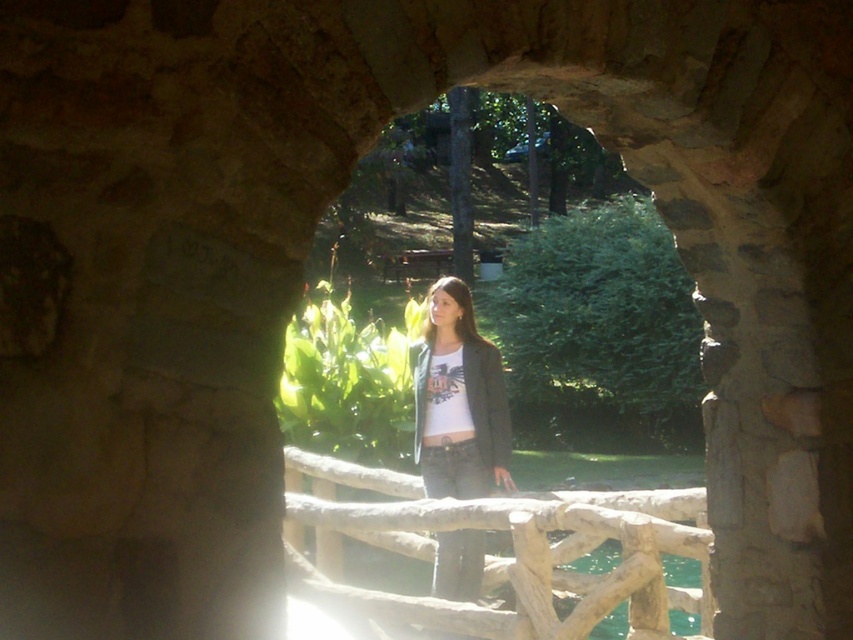
Which is behind, point (682, 636) or point (436, 564)?

The point (682, 636) is behind.

From the picture: Does wooden at center appear over matte black jacket at center?

No.

Is point (341, 470) farther from viewer compared to point (437, 346)?

Yes.

I want to click on wooden at center, so click(x=502, y=556).